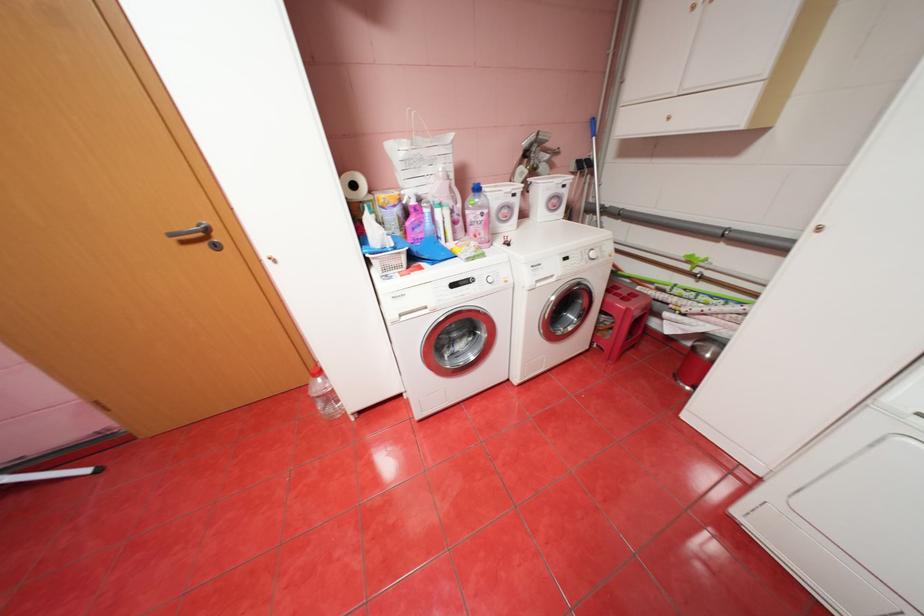
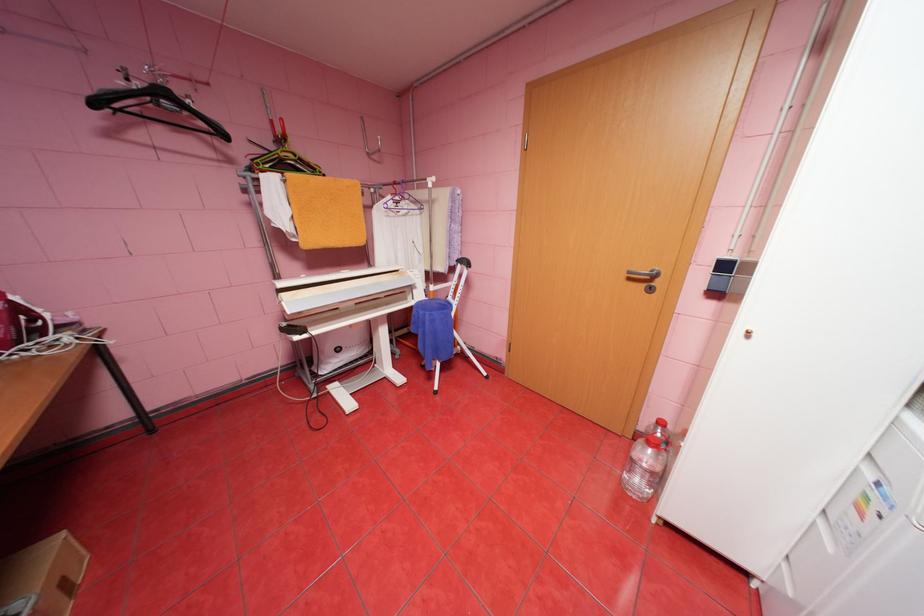
Where in the second image is the point corresponding to (213,245) from the first image?

(650, 285)